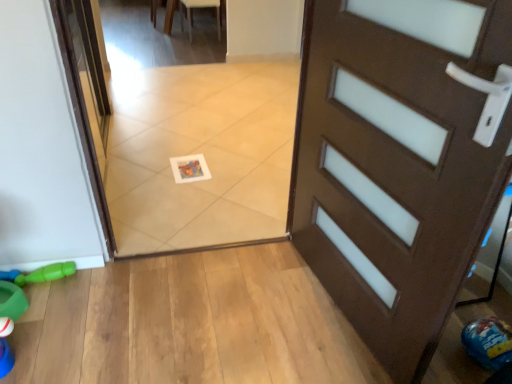
Question: From the image's perspective, does white leather chair at upper center appear higher than green rubber toy at lower left?

Choices:
 (A) yes
 (B) no

Answer: (A)

Question: Is white leather chair at upper center bigger than green rubber toy at lower left?

Choices:
 (A) no
 (B) yes

Answer: (B)

Question: Considering the relative sizes of white leather chair at upper center and green rubber toy at lower left in the image provided, is white leather chair at upper center shorter than green rubber toy at lower left?

Choices:
 (A) no
 (B) yes

Answer: (A)

Question: Considering the relative sizes of white leather chair at upper center and green rubber toy at lower left in the image provided, is white leather chair at upper center taller than green rubber toy at lower left?

Choices:
 (A) no
 (B) yes

Answer: (B)

Question: Does white leather chair at upper center have a greater width compared to green rubber toy at lower left?

Choices:
 (A) yes
 (B) no

Answer: (A)

Question: Could you tell me if white leather chair at upper center is facing green rubber toy at lower left?

Choices:
 (A) no
 (B) yes

Answer: (A)

Question: Would you say white leather chair at upper center is part of green rubber toy at lower left's contents?

Choices:
 (A) no
 (B) yes

Answer: (A)

Question: Could you tell me if green rubber toy at lower left is turned towards white leather chair at upper center?

Choices:
 (A) no
 (B) yes

Answer: (A)

Question: Can you confirm if green rubber toy at lower left is taller than white leather chair at upper center?

Choices:
 (A) no
 (B) yes

Answer: (A)

Question: Considering the relative sizes of green rubber toy at lower left and white leather chair at upper center in the image provided, is green rubber toy at lower left bigger than white leather chair at upper center?

Choices:
 (A) no
 (B) yes

Answer: (A)

Question: Would you consider green rubber toy at lower left to be distant from white leather chair at upper center?

Choices:
 (A) no
 (B) yes

Answer: (B)

Question: From a real-world perspective, is green rubber toy at lower left located higher than white leather chair at upper center?

Choices:
 (A) yes
 (B) no

Answer: (B)

Question: Would you say green rubber toy at lower left is inside or outside white leather chair at upper center?

Choices:
 (A) inside
 (B) outside

Answer: (B)